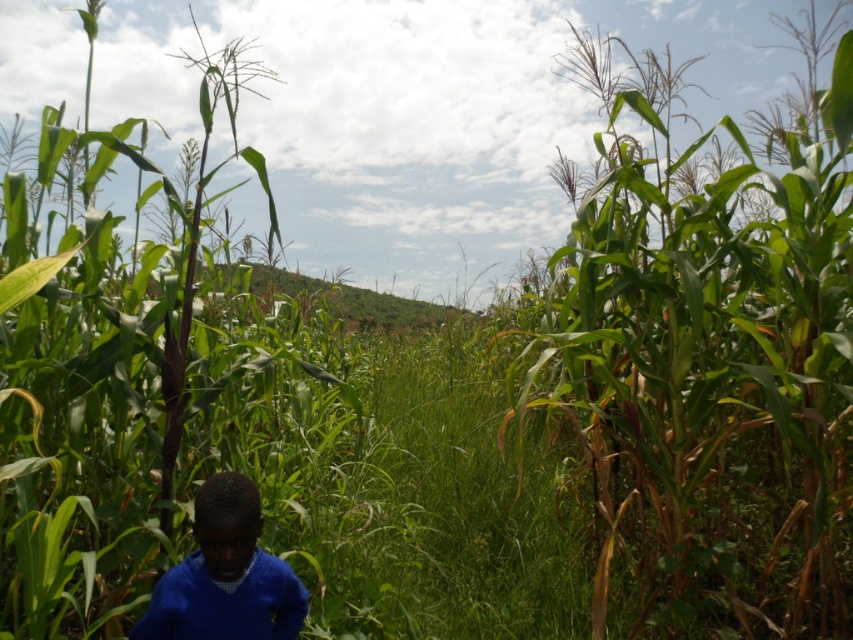
You are a parent trying to locate your child in a cornfield. You see the green leafy corn at center and the blue sweater at lower left. How far apart are these two objects?

The green leafy corn at center is 7.50 feet away from the blue sweater at lower left.

You are standing in a rural area with tall corn plants. You see the green leafy corn at center. If you want to walk through the space between the corn plants, where should you go?

The green leafy corn at center is located at point [712,368], so you should walk towards the center area where the corn plants are densely packed to navigate through the corridor formed by them.

You are a parent looking for your child in a cornfield. You see the green leafy corn at center and the blue sweater at lower left. Which object is closer to the left side of the image?

The blue sweater at lower left is closer to the left side of the image because it is positioned on the left side of the green leafy corn at center.